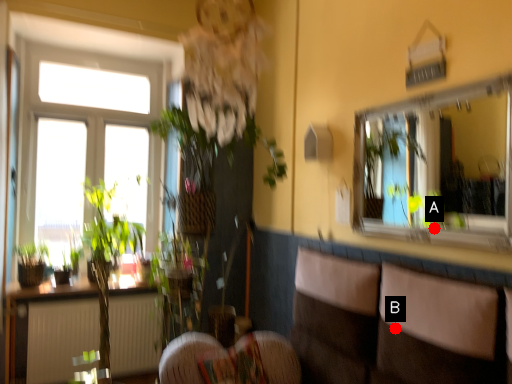
Question: Two points are circled on the image, labeled by A and B beside each circle. Among these points, which one is nearest to the camera?

Choices:
 (A) A is closer
 (B) B is closer

Answer: (B)